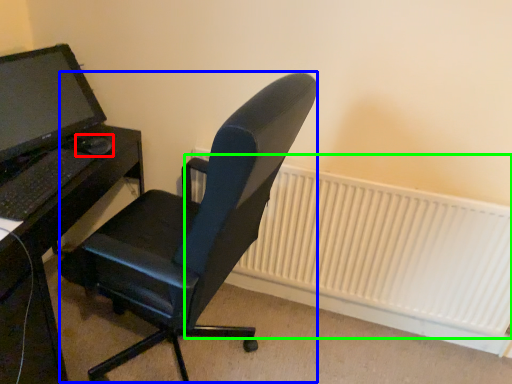
Question: Based on their relative distances, which object is farther from mouse (highlighted by a red box)? Choose from computer chair (highlighted by a blue box) and radiator (highlighted by a green box).

Choices:
 (A) computer chair
 (B) radiator

Answer: (B)